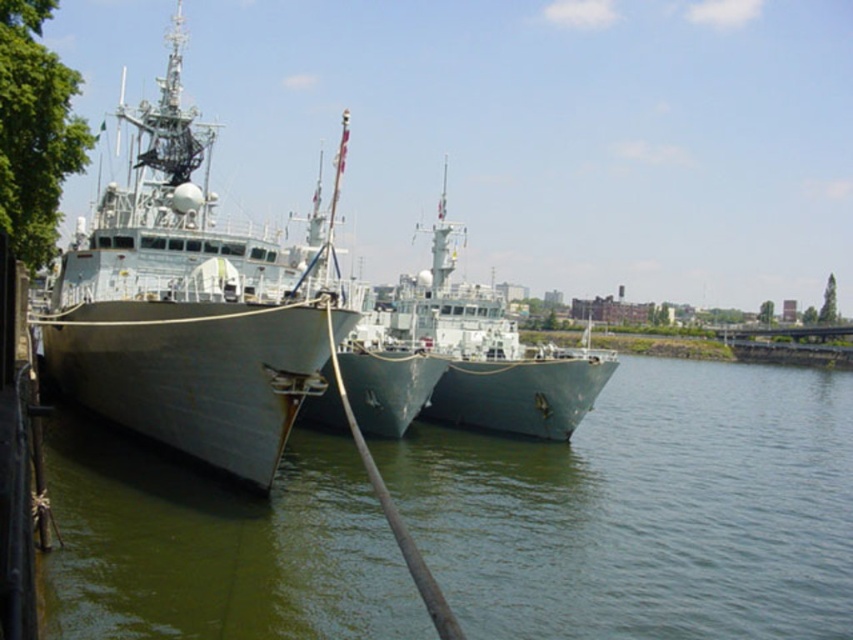
You are standing on the pier looking at the two naval ships. There are two points marked on the ships. Which point, point (321, 568) or point (454, 321), is closer to you?

Point (321, 568) is closer to the viewer than point (454, 321).

You are a sailor on the green matte ship at center. You notice something floating in the greenish water at center. Which direction should you look to see the object?

The greenish water at center is located below the green matte ship at center, so you should look downward to see the object in the greenish water at center.